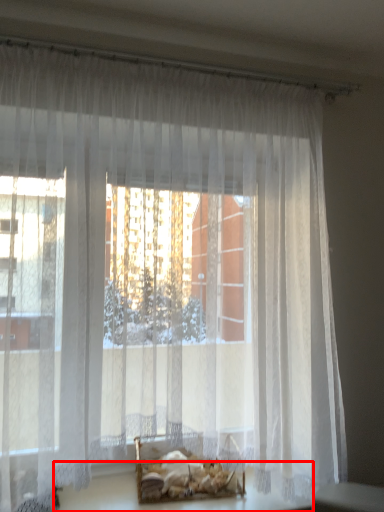
Question: Observing the image, what is the correct spatial positioning of table (annotated by the red box) in reference to bed?

Choices:
 (A) left
 (B) right

Answer: (B)